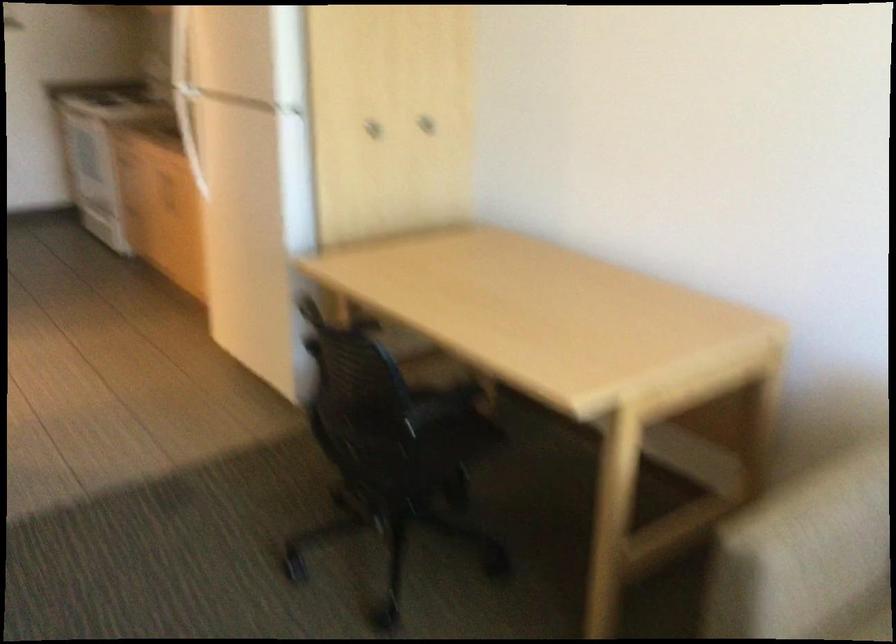
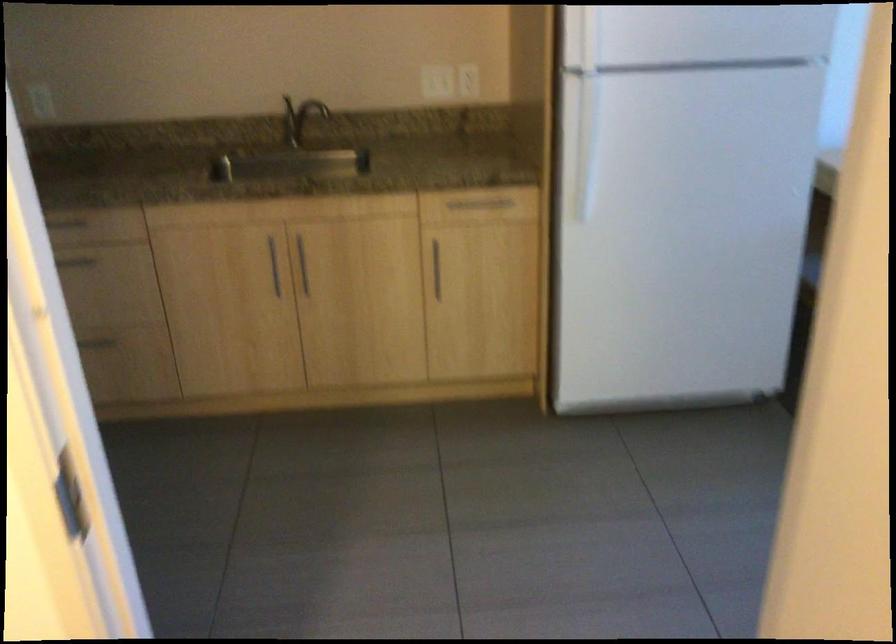
Where in the second image is the point corresponding to point (195, 193) from the first image?

(303, 265)